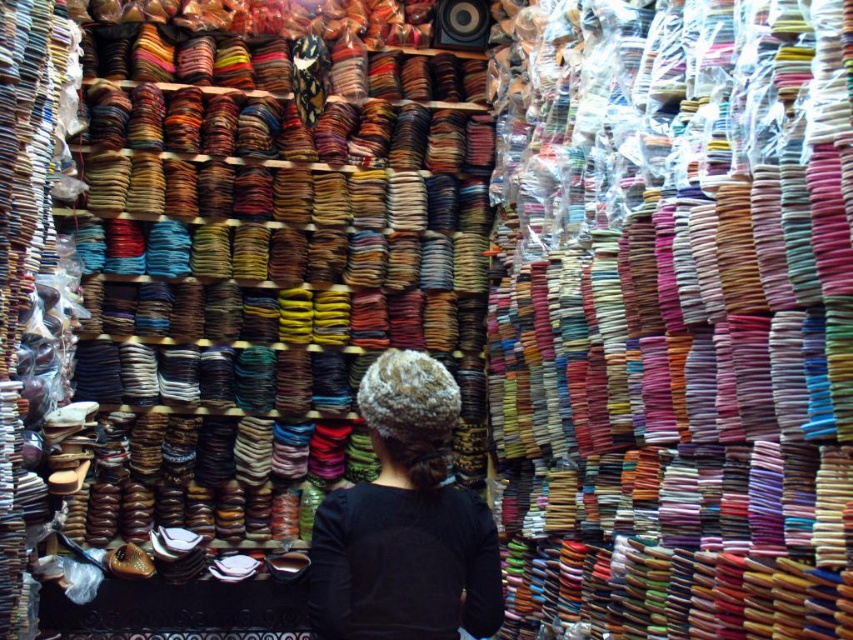
You are a customer at the market stall looking to buy a bangle. You notice the shiny plastic bangles at center and the black matte hair at center. Which of these two items is bigger in size?

The shiny plastic bangles at center has a larger size compared to the black matte hair at center.

You are a customer at the market stall and want to know which item is taller between the shiny plastic bangles at center and the black matte hair at center. Which one is taller?

The shiny plastic bangles at center has a greater height compared to the black matte hair at center, so the shiny plastic bangles at center is taller.